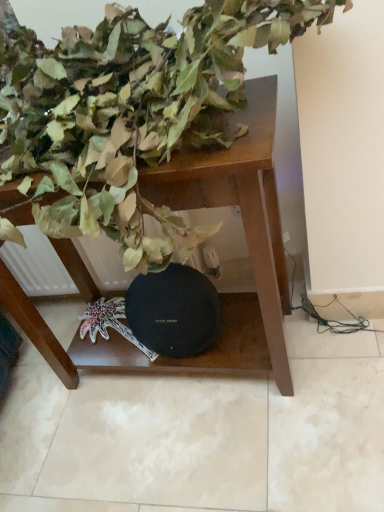
Identify the location of free space in front of brown wooden table at center. The width and height of the screenshot is (384, 512). (209, 458).